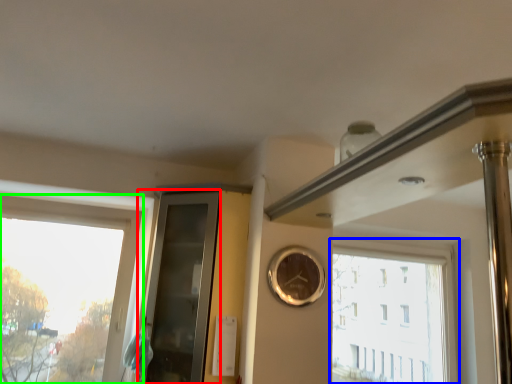
Question: Estimate the real-world distances between objects in this image. Which object is closer to glass door (highlighted by a red box), window (highlighted by a blue box) or window (highlighted by a green box)?

Choices:
 (A) window
 (B) window

Answer: (B)